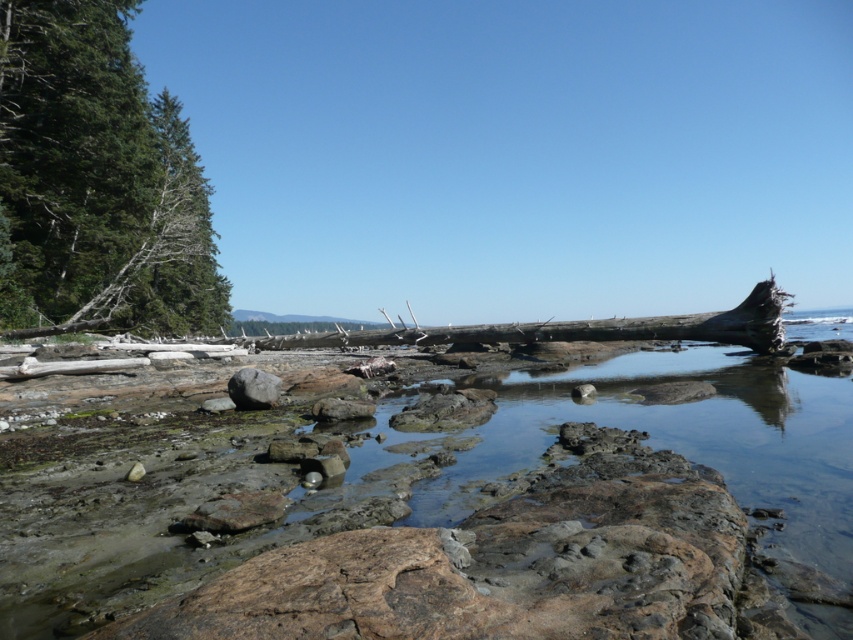
Question: Which of the following is the farthest from the observer?

Choices:
 (A) gray smooth rock at center
 (B) green rough bark tree at left

Answer: (B)

Question: Is the position of green rough bark tree at left more distant than that of gray smooth rock at center?

Choices:
 (A) no
 (B) yes

Answer: (B)

Question: Is green rough bark tree at left further to camera compared to gray smooth rock at center?

Choices:
 (A) no
 (B) yes

Answer: (B)

Question: Which object appears farthest from the camera in this image?

Choices:
 (A) green rough bark tree at left
 (B) gray smooth rock at center

Answer: (A)

Question: Is the position of green rough bark tree at left more distant than that of gray smooth rock at center?

Choices:
 (A) no
 (B) yes

Answer: (B)